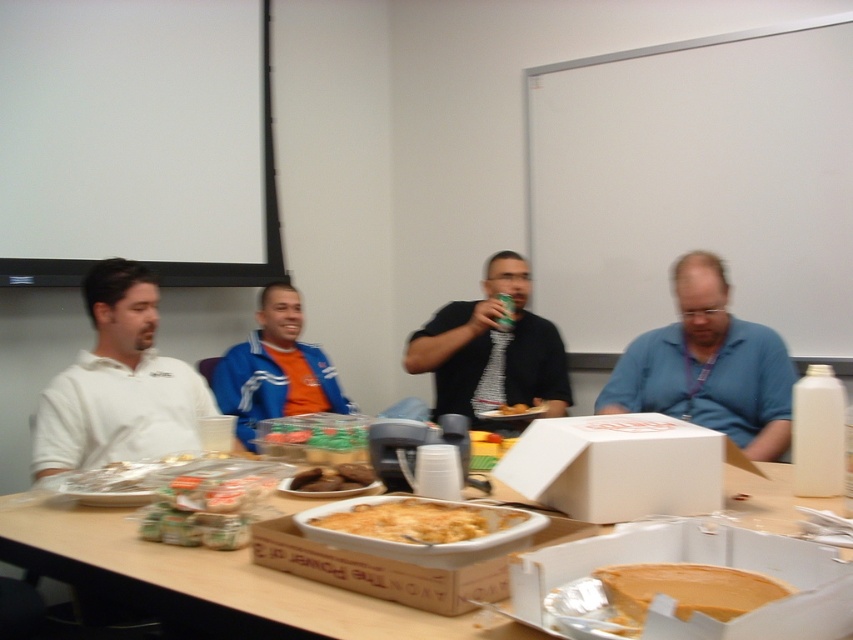
Is white matte shirt at left further to the viewer compared to blue matte shirt at center?

No, white matte shirt at left is closer to the viewer.

Can you confirm if white matte shirt at left is positioned below blue matte shirt at center?

Indeed, white matte shirt at left is positioned under blue matte shirt at center.

Which is behind, point (146, 436) or point (688, 342)?

The point (688, 342) is more distant.

You are a GUI agent. You are given a task and a screenshot of the screen. Output one action in this format:
    pyautogui.click(x=<x>, y=<y>)
    Task: Click on the white matte shirt at left
    The image size is (853, 640).
    Given the screenshot: What is the action you would take?
    pyautogui.click(x=119, y=384)

Is point (770, 356) positioned behind point (225, 400)?

No, (770, 356) is closer to viewer.

The height and width of the screenshot is (640, 853). Describe the element at coordinates (708, 365) in the screenshot. I see `blue matte shirt at center` at that location.

Does point (651, 340) come farther from viewer compared to point (251, 337)?

No, it is not.

Find the location of a particular element. This screenshot has height=640, width=853. blue matte shirt at center is located at coordinates (708, 365).

Is brown matte cookies at center wider than yellow cake at center?

Correct, the width of brown matte cookies at center exceeds that of yellow cake at center.

Is point (349, 476) farther from viewer compared to point (506, 404)?

That is False.

Is point (291, 483) behind point (492, 416)?

No, (291, 483) is in front of (492, 416).

Where is `brown matte cookies at center`? The width and height of the screenshot is (853, 640). brown matte cookies at center is located at coordinates (332, 477).